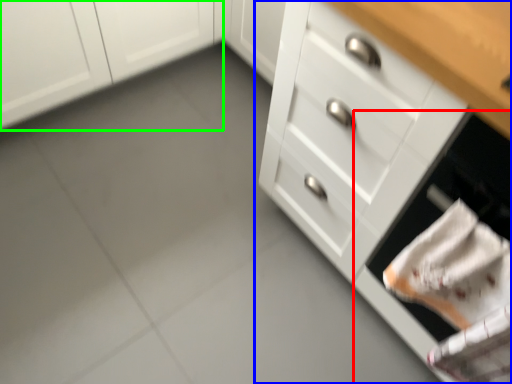
Question: Which object is positioned farthest from oven (highlighted by a red box)? Select from chest of drawers (highlighted by a blue box) and cabinetry (highlighted by a green box).

Choices:
 (A) chest of drawers
 (B) cabinetry

Answer: (B)